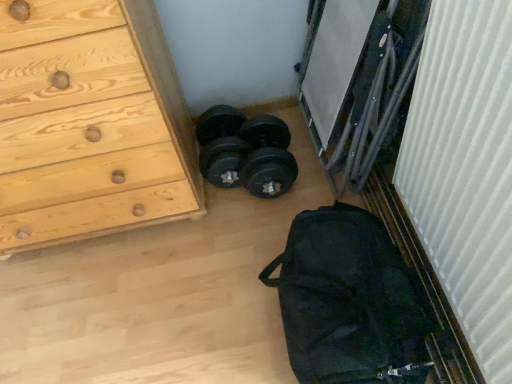
Question: Is white ribbed curtain at right shorter than black rubber dumbbells at center?

Choices:
 (A) no
 (B) yes

Answer: (A)

Question: Is white ribbed curtain at right not inside black rubber dumbbells at center?

Choices:
 (A) no
 (B) yes

Answer: (B)

Question: Is white ribbed curtain at right to the left of black rubber dumbbells at center from the viewer's perspective?

Choices:
 (A) no
 (B) yes

Answer: (A)

Question: From the image's perspective, is white ribbed curtain at right above black rubber dumbbells at center?

Choices:
 (A) no
 (B) yes

Answer: (A)

Question: Can you confirm if white ribbed curtain at right is positioned to the right of black rubber dumbbells at center?

Choices:
 (A) yes
 (B) no

Answer: (A)

Question: Is white ribbed curtain at right bigger than black rubber dumbbells at center?

Choices:
 (A) no
 (B) yes

Answer: (B)

Question: Is the depth of white ribbed curtain at right greater than that of black fabric bag at lower right?

Choices:
 (A) no
 (B) yes

Answer: (A)

Question: Is black fabric bag at lower right a part of white ribbed curtain at right?

Choices:
 (A) yes
 (B) no

Answer: (B)

Question: From a real-world perspective, is white ribbed curtain at right on top of black fabric bag at lower right?

Choices:
 (A) yes
 (B) no

Answer: (A)

Question: Is white ribbed curtain at right smaller than black fabric bag at lower right?

Choices:
 (A) yes
 (B) no

Answer: (B)

Question: Considering the relative sizes of white ribbed curtain at right and black fabric bag at lower right in the image provided, is white ribbed curtain at right wider than black fabric bag at lower right?

Choices:
 (A) yes
 (B) no

Answer: (B)

Question: Is the position of white ribbed curtain at right less distant than that of black fabric bag at lower right?

Choices:
 (A) yes
 (B) no

Answer: (A)

Question: Does white ribbed curtain at right contain natural wood chest of drawers at left?

Choices:
 (A) no
 (B) yes

Answer: (A)